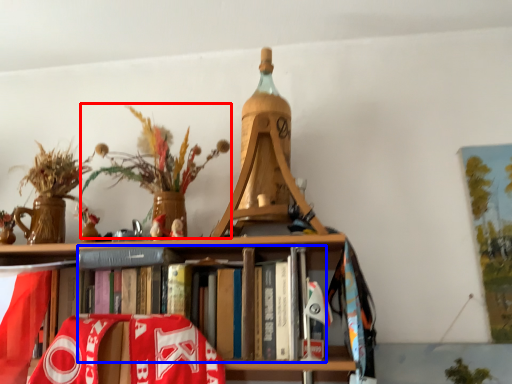
Question: Which object is further to the camera taking this photo, floral arrangement (highlighted by a red box) or book (highlighted by a blue box)?

Choices:
 (A) floral arrangement
 (B) book

Answer: (A)